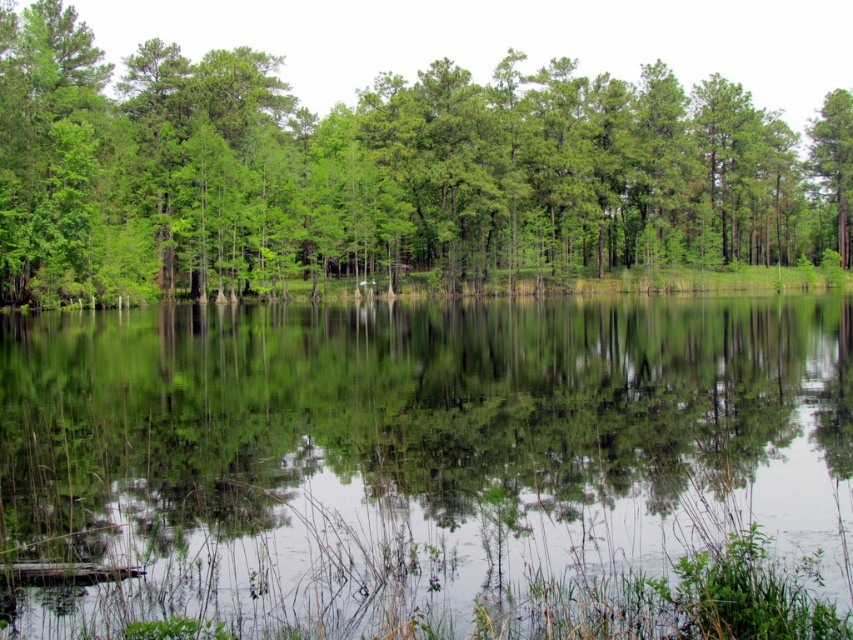
You are standing at the edge of the water and want to take a photo of the green leafy tree at center. Since the clear water at center is in the way, will you need to move forward or backward to get the tree in focus without the water obstructing the view?

Since the clear water at center is closer to the viewer than the green leafy tree at center, you would need to move forward to get the tree in focus and avoid the water obstructing the view.